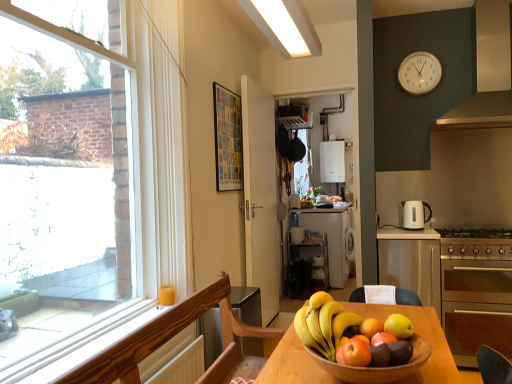
Where is `vacant region above wooden bowl at center (from a real-world perspective)`? This screenshot has width=512, height=384. vacant region above wooden bowl at center (from a real-world perspective) is located at coordinates (367, 340).